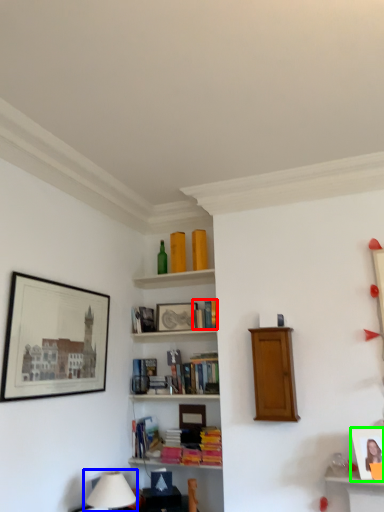
Question: Which object is positioned closest to book (highlighted by a red box)? Select from table lamp (highlighted by a blue box) and picture frame (highlighted by a green box).

Choices:
 (A) table lamp
 (B) picture frame

Answer: (B)